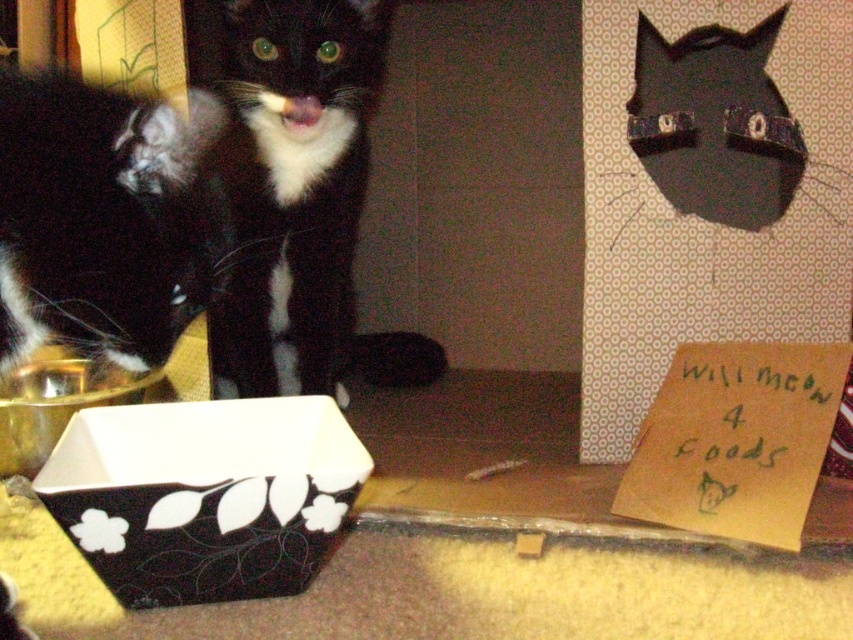
Question: Estimate the real-world distances between objects in this image. Which object is closer to the black fur cat at left?

Choices:
 (A) black matte fur cat at center
 (B) black matte box at lower left
 (C) yellow cardboard at lower right

Answer: (B)

Question: Considering the real-world distances, which object is closest to the yellow cardboard at lower right?

Choices:
 (A) black matte fur cat at center
 (B) black matte box at lower left
 (C) black fur cat at left

Answer: (B)

Question: In this image, where is black matte fur cat at center located relative to yellow cardboard at lower right?

Choices:
 (A) above
 (B) below

Answer: (A)

Question: Which object is the closest to the black fur cat at left?

Choices:
 (A) black matte box at lower left
 (B) black matte fur cat at center
 (C) yellow cardboard at lower right

Answer: (A)

Question: Can you confirm if black fur cat at left is positioned to the left of black matte box at lower left?

Choices:
 (A) no
 (B) yes

Answer: (B)

Question: Is black matte fur cat at center bigger than black fur cat at left?

Choices:
 (A) yes
 (B) no

Answer: (A)